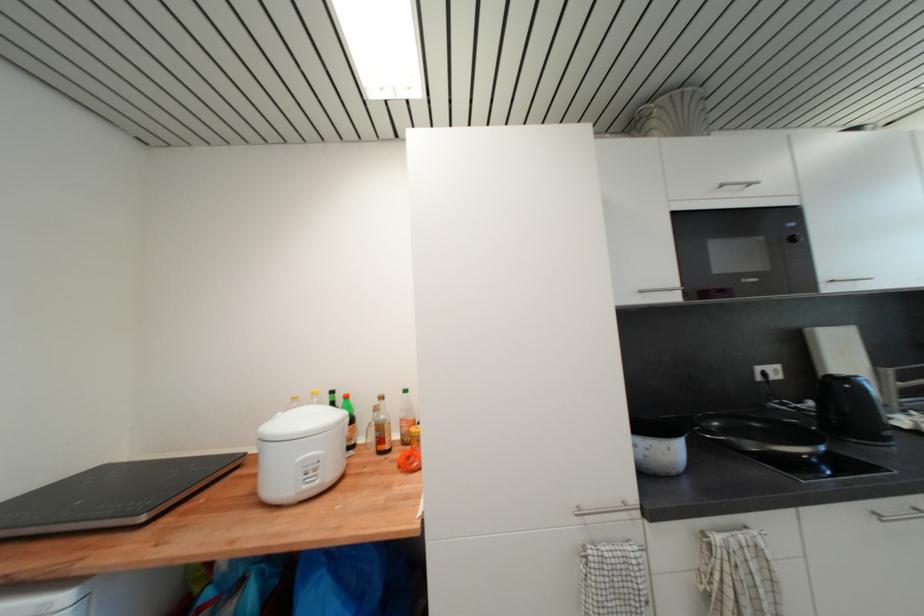
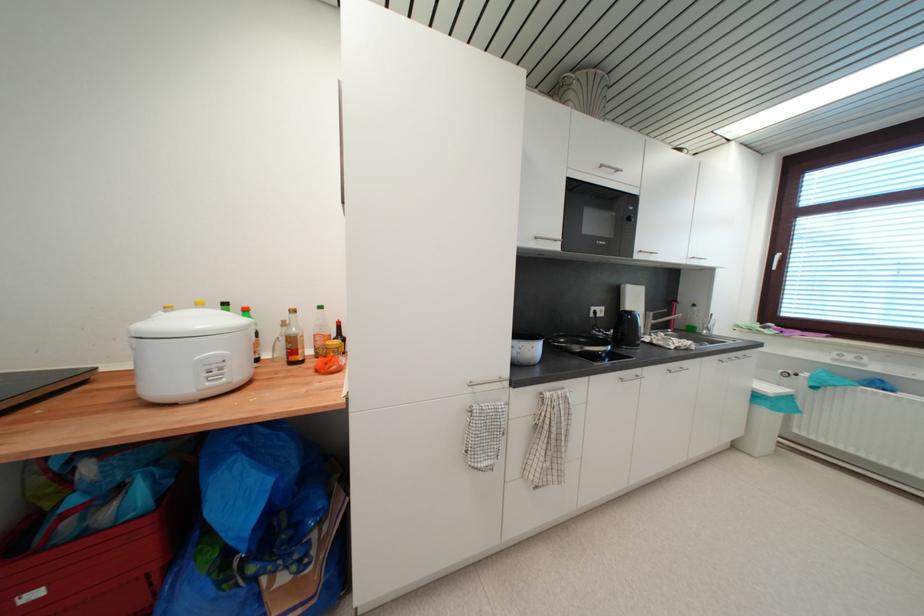
Find the pixel in the second image that matches point 763,381 in the first image.

(597, 317)